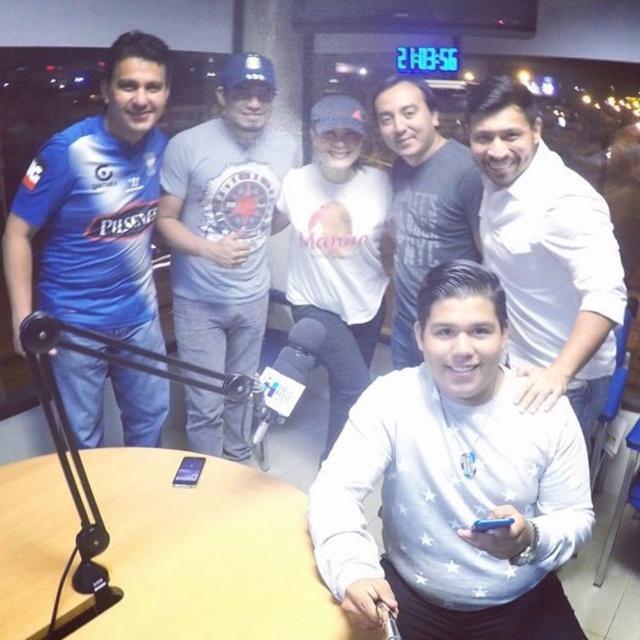
What is the object located at the coordinates point (205,554) in the scene?

The point (205,554) marks the wooden table at center.

You are a photographer positioned at the back of the room. You want to take a photo of the wooden table at center but notice the white matte sweatshirt at center is blocking your view. Can you move the sweatshirt to capture the table?

The white matte sweatshirt at center is in front of the wooden table at center, so moving the sweatshirt would allow you to see the table.

Based on the photo, you are a photographer standing in the studio and need to capture a closeup shot of the wooden table at center. The white matte sweatshirt at center is in the way. Can you move the sweatshirt to get a clear shot? Explain why or why not.

The distance between the white matte sweatshirt at center and the wooden table at center is 14.89 inches, so moving the sweatshirt would allow you to get a clear shot of the wooden table at center.